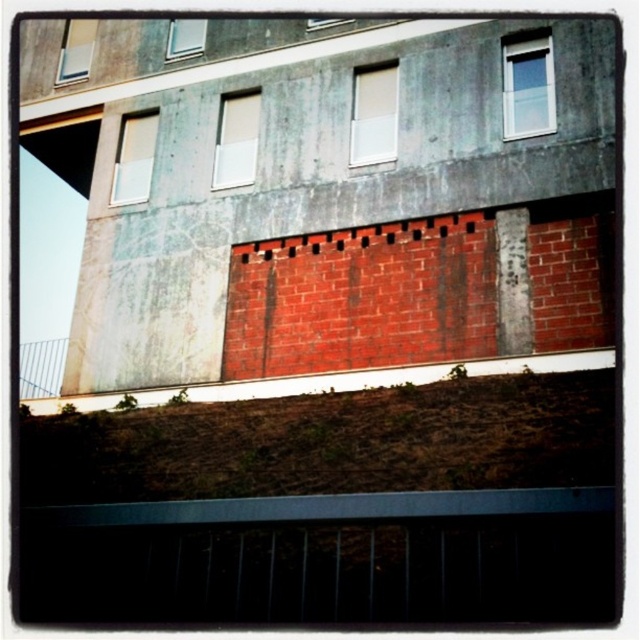
Question: Can you confirm if matte white window at center is positioned to the left of matte glass window at upper left?

Choices:
 (A) yes
 (B) no

Answer: (B)

Question: Which of the following is the closest to the observer?

Choices:
 (A) matte white window at center
 (B) white glass window at upper right
 (C) white matte window at upper left
 (D) brown grass at lower center

Answer: (D)

Question: Among these objects, which one is nearest to the camera?

Choices:
 (A) white matte window at upper center
 (B) matte white window at center

Answer: (A)

Question: Where is matte white window at center located in relation to matte glass window at upper left in the image?

Choices:
 (A) below
 (B) above

Answer: (A)

Question: Can you confirm if white matte window at upper left is thinner than matte glass window at upper left?

Choices:
 (A) yes
 (B) no

Answer: (B)

Question: Which object is closer to the camera taking this photo?

Choices:
 (A) matte glass window at upper center
 (B) white matte window at upper center

Answer: (A)